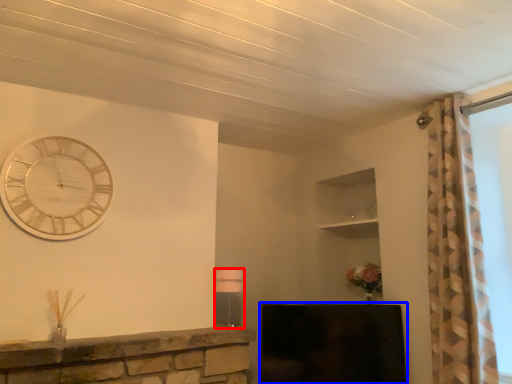
Question: Among these objects, which one is nearest to the camera, lamp (highlighted by a red box) or fireplace (highlighted by a blue box)?

Choices:
 (A) lamp
 (B) fireplace

Answer: (A)